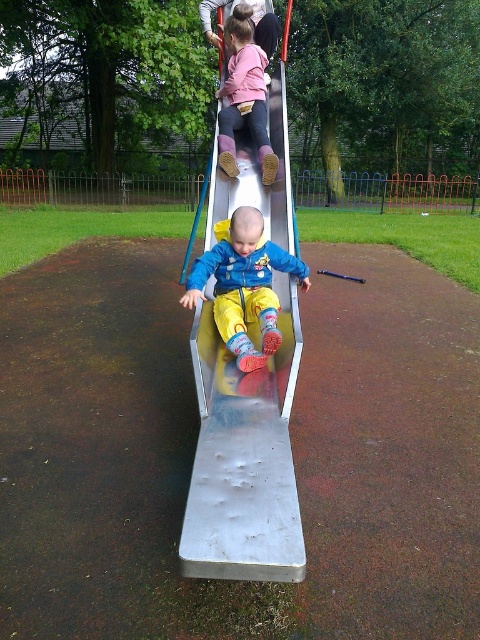
You are a parent watching your child play at the playground. You see the metallic smooth slide at center and the matte pink sweater at upper center. Which object is closer to you?

The metallic smooth slide at center is closer to you because it is in front of the matte pink sweater at upper center.

You are a parent at the playground. You notice your child is wearing a matte pink sweater at upper center and sliding down the metallic smooth slide at center. Considering the height difference, could the sweater potentially get caught on the slide?

The metallic smooth slide at center has a lesser height compared to matte pink sweater at upper center. Since the slide is shorter than the sweater, the sweater might hang lower than the slide, possibly getting caught as the child slides down. Ensure the sweater is tucked in or adjusted to avoid any snagging.

You are a parent at the playground and see your child playing. You notice a metallic smooth slide at center and a matte pink sweater at upper center. Which object is positioned to the right of the other?

The metallic smooth slide at center is positioned to the right of the matte pink sweater at upper center.